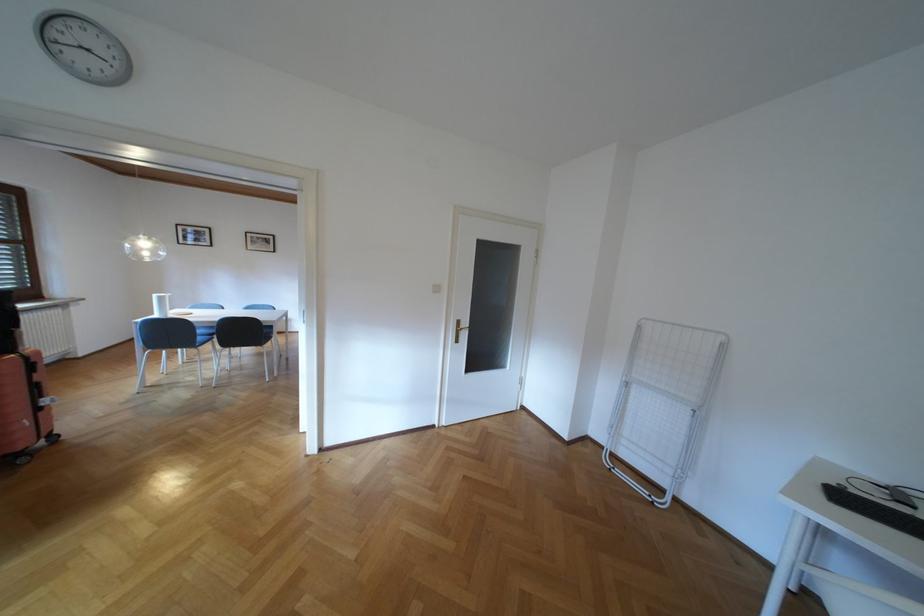
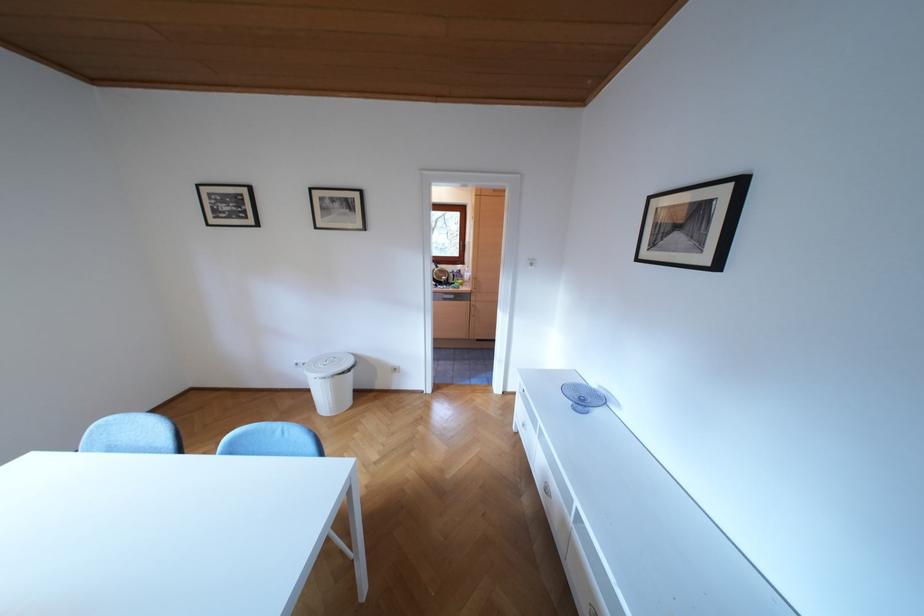
In a continuous first-person perspective shot, in which direction is the camera moving?

The cameraman moved toward left, forward.